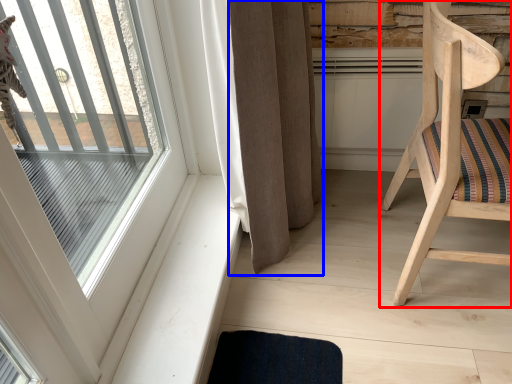
Question: Which object is closer to the camera taking this photo, chair (highlighted by a red box) or curtain (highlighted by a blue box)?

Choices:
 (A) chair
 (B) curtain

Answer: (A)